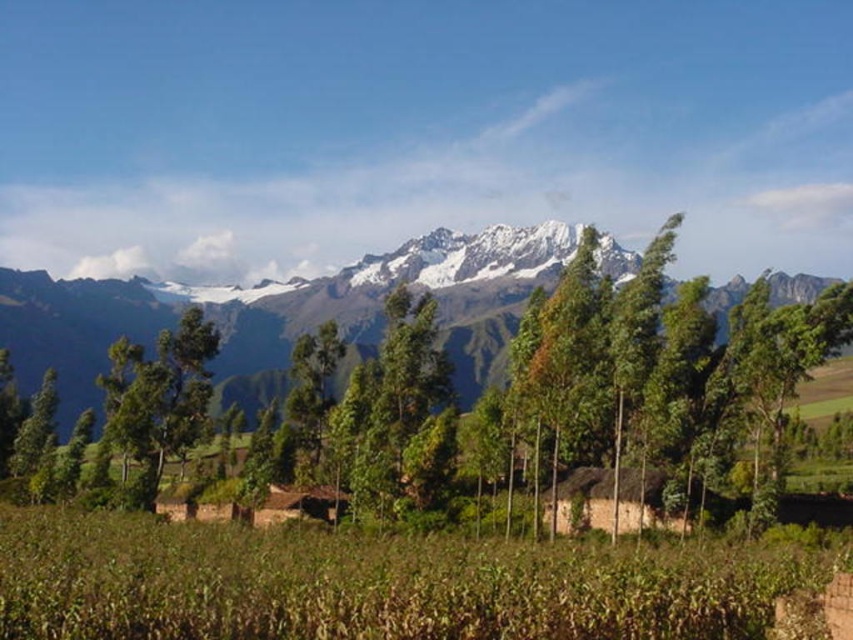
Question: Is green grassy field at lower center closer to the viewer compared to snowy rock mountain range at upper center?

Choices:
 (A) no
 (B) yes

Answer: (B)

Question: Can you confirm if green grassy field at lower center is thinner than green leafy tree at center?

Choices:
 (A) yes
 (B) no

Answer: (B)

Question: Which object is closer to the camera taking this photo?

Choices:
 (A) snowy rock mountain range at upper center
 (B) green grassy field at lower center

Answer: (B)

Question: Which object is positioned farthest from the green grassy field at lower center?

Choices:
 (A) snowy rock mountain range at upper center
 (B) green leafy tree at center

Answer: (A)

Question: Does snowy rock mountain range at upper center appear under green leafy tree at center?

Choices:
 (A) yes
 (B) no

Answer: (B)

Question: Which of these objects is positioned farthest from the snowy rock mountain range at upper center?

Choices:
 (A) green grassy field at lower center
 (B) green leafy tree at center

Answer: (A)